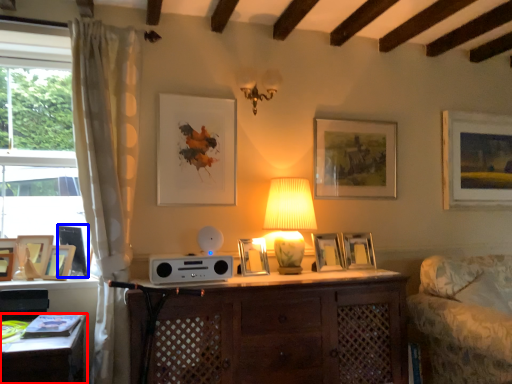
Question: Which of the following is the closest to the observer, desk (highlighted by a red box) or picture frame (highlighted by a blue box)?

Choices:
 (A) desk
 (B) picture frame

Answer: (A)